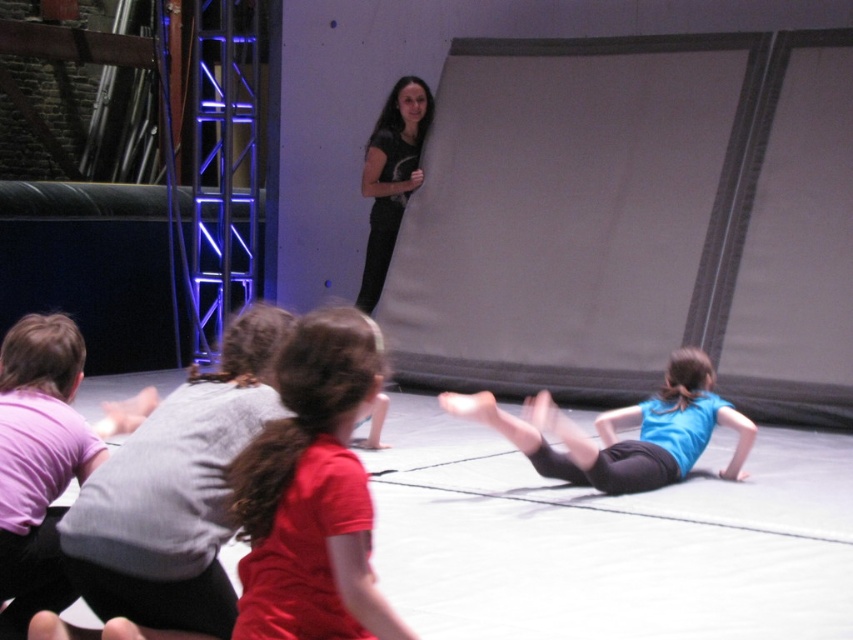
Is matte gray shirt at lower left wider than matte black shirt at upper center?

Correct, the width of matte gray shirt at lower left exceeds that of matte black shirt at upper center.

Is point (93, 556) less distant than point (370, 173)?

Yes.

Locate an element on the screen. matte gray shirt at lower left is located at coordinates (177, 492).

Between matte gray shirt at lower left and blue matte shirt at lower right, which one appears on the left side from the viewer's perspective?

matte gray shirt at lower left is more to the left.

Does matte gray shirt at lower left have a smaller size compared to blue matte shirt at lower right?

Yes.

Locate an element on the screen. matte gray shirt at lower left is located at coordinates (177, 492).

The height and width of the screenshot is (640, 853). What do you see at coordinates (312, 493) in the screenshot? I see `matte red shirt at center` at bounding box center [312, 493].

Find the location of a particular element. matte red shirt at center is located at coordinates (312, 493).